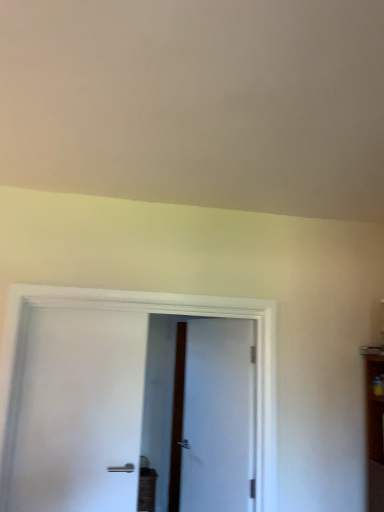
Question: Relative to white matte door at left, marked as the second door in a back-to-front arrangement, is white textured door at center, the second door when ordered from left to right, in front or behind?

Choices:
 (A) behind
 (B) front

Answer: (A)

Question: Does point (244, 495) appear closer or farther from the camera than point (43, 404)?

Choices:
 (A) farther
 (B) closer

Answer: (A)

Question: From the image's perspective, relative to white matte door at left, marked as the second door in a back-to-front arrangement, is white textured door at center, the first door when ordered from right to left, above or below?

Choices:
 (A) below
 (B) above

Answer: (A)

Question: Is point (132, 443) closer or farther from the camera than point (220, 411)?

Choices:
 (A) farther
 (B) closer

Answer: (B)

Question: In terms of height, does white matte door at left, which is counted as the 2th door, starting from the right, look taller or shorter compared to white textured door at center, the second door when ordered from left to right?

Choices:
 (A) short
 (B) tall

Answer: (A)

Question: From a real-world perspective, is white matte door at left, acting as the 1th door starting from the front, physically located above or below white textured door at center, the first door when ordered from right to left?

Choices:
 (A) above
 (B) below

Answer: (A)

Question: Considering the positions of white matte door at left, which is counted as the 2th door, starting from the right, and white textured door at center, the first door when ordered from right to left, in the image, is white matte door at left, which is counted as the 2th door, starting from the right, bigger or smaller than white textured door at center, the first door when ordered from right to left,?

Choices:
 (A) small
 (B) big

Answer: (A)